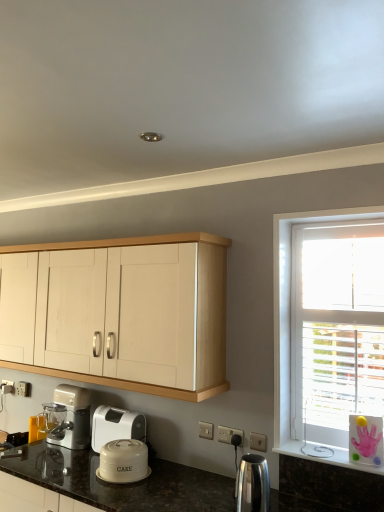
Locate an element on the screen. This screenshot has height=512, width=384. free spot above matte white cake container at lower center, which appears as the 2th kitchen appliance when viewed from the front (from a real-world perspective) is located at coordinates (125, 445).